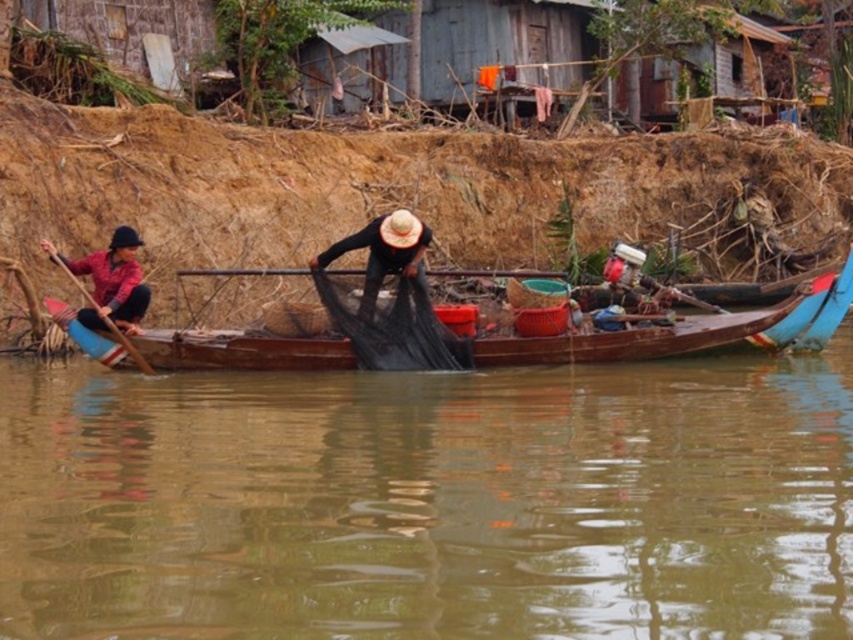
Consider the image. Measure the distance between brown matte water at center and brown wooden boat at center.

5.22 meters

Consider the image. Can you confirm if brown matte water at center is shorter than brown wooden boat at center?

In fact, brown matte water at center may be taller than brown wooden boat at center.

Is point (535, 465) farther from camera compared to point (730, 320)?

No, it is not.

This screenshot has width=853, height=640. In order to click on brown matte water at center in this screenshot , I will do `click(430, 500)`.

Is brown wooden boat at center bigger than dark brown woven hat at center?

Yes, brown wooden boat at center is bigger than dark brown woven hat at center.

Locate an element on the screen. The width and height of the screenshot is (853, 640). brown wooden boat at center is located at coordinates (639, 339).

At what (x,y) coordinates should I click in order to perform the action: click on brown wooden boat at center. Please return your answer as a coordinate pair (x, y). This screenshot has height=640, width=853. Looking at the image, I should click on (639, 339).

Is dark brown woven hat at center behind wooden paddle at left?

Yes, dark brown woven hat at center is further from the viewer.

Which is above, dark brown woven hat at center or wooden paddle at left?

dark brown woven hat at center is higher up.

Between point (393, 230) and point (115, 333), which one is positioned in front?

Point (393, 230)

This screenshot has height=640, width=853. I want to click on dark brown woven hat at center, so click(x=386, y=257).